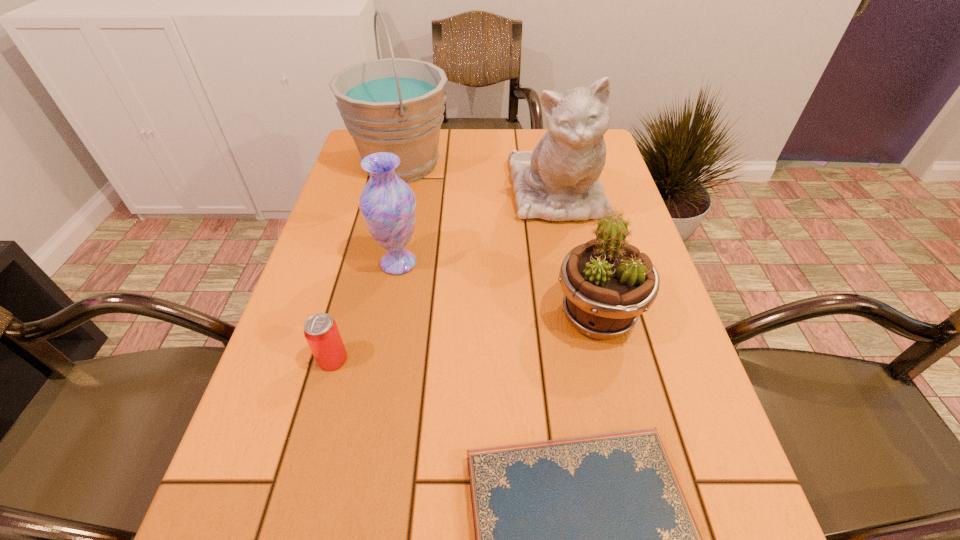
Image resolution: width=960 pixels, height=540 pixels. What are the coordinates of `bucket` in the screenshot? It's located at (396, 105).

Identify the location of cat. This screenshot has width=960, height=540. (559, 180).

The height and width of the screenshot is (540, 960). I want to click on vase, so click(x=387, y=203).

Identify the location of flowerpot. The height and width of the screenshot is (540, 960). (608, 283).

Where is `the second shortest object`? the second shortest object is located at coordinates (321, 332).

Identify the location of vacant region located 0.130m on the front of the bucket. (388, 223).

Find the location of a particular element. This screenshot has width=960, height=540. free spot located 0.290m on the front-facing side of the cat is located at coordinates (586, 332).

In order to click on vacant region located on the left of the fourth nearest object in this screenshot , I will do `click(330, 263)`.

Find the location of a particular element. Image resolution: width=960 pixels, height=540 pixels. vacant space located on the back of the flowerpot is located at coordinates (581, 245).

The image size is (960, 540). Identify the location of free space located on the back of the can. (371, 220).